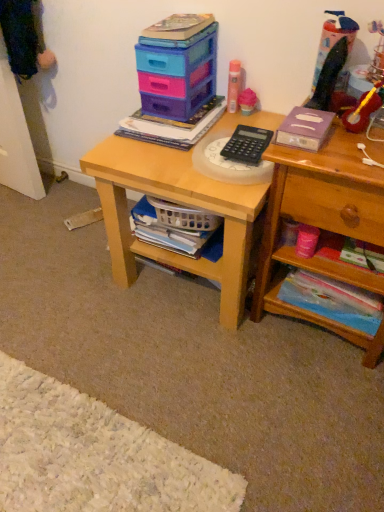
Locate an element on the screen. free location to the left of black plastic calculator at center is located at coordinates (162, 157).